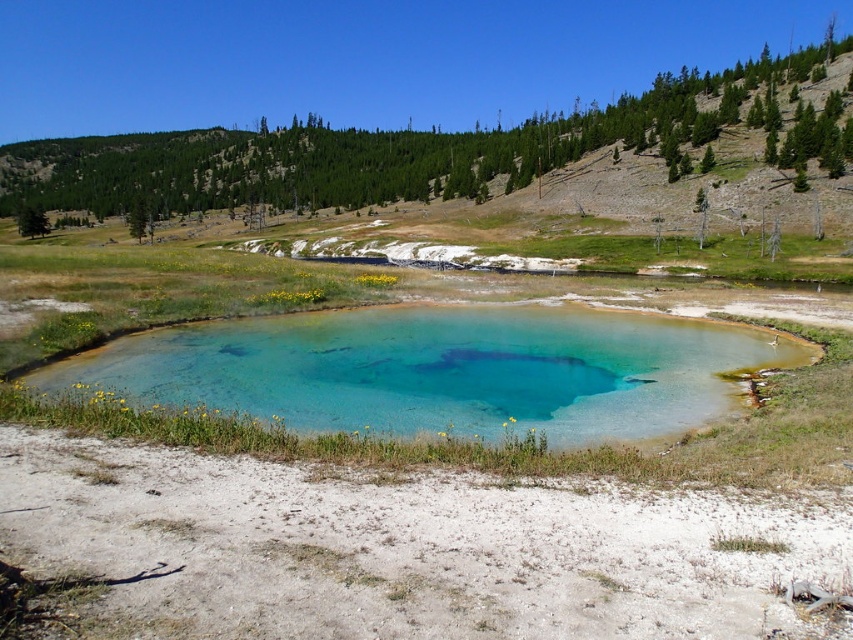
Between turquoise glass pond at center and green grassy hillside at upper center, which one appears on the left side from the viewer's perspective?

green grassy hillside at upper center is more to the left.

Is turquoise glass pond at center in front of green grassy hillside at upper center?

Yes.

Is point (242, 387) in front of point (131, 182)?

Yes, point (242, 387) is closer to viewer.

Locate an element on the screen. Image resolution: width=853 pixels, height=640 pixels. turquoise glass pond at center is located at coordinates (442, 371).